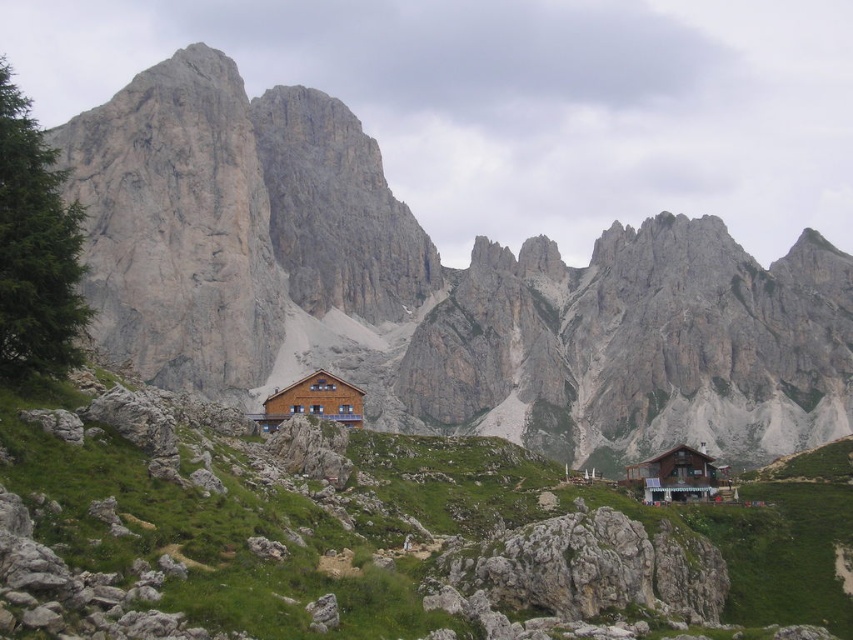
Which is more to the right, matte brown wooden cabin at center or wooden cabin at center?

From the viewer's perspective, matte brown wooden cabin at center appears more on the right side.

Who is more forward, (186,301) or (279,403)?

Positioned in front is point (279,403).

Does point (170, 68) come farther from viewer compared to point (316, 394)?

Yes, point (170, 68) is farther from viewer.

At what (x,y) coordinates should I click in order to perform the action: click on matte brown wooden cabin at center. Please return your answer as a coordinate pair (x, y). This screenshot has width=853, height=640. Looking at the image, I should click on (433, 289).

Who is lower down, wooden cabin at center or wooden cabin at lower right?

wooden cabin at lower right is lower down.

The image size is (853, 640). In order to click on wooden cabin at center in this screenshot , I will do `click(314, 401)`.

This screenshot has width=853, height=640. What are the coordinates of `wooden cabin at center` in the screenshot? It's located at [314, 401].

Who is positioned more to the left, matte brown wooden cabin at center or wooden cabin at lower right?

Positioned to the left is matte brown wooden cabin at center.

Is point (175, 369) positioned in front of point (699, 477)?

No, it is not.

Is point (296, 189) positioned behind point (650, 468)?

Yes, it is.

What are the coordinates of `matte brown wooden cabin at center` in the screenshot? It's located at (433, 289).